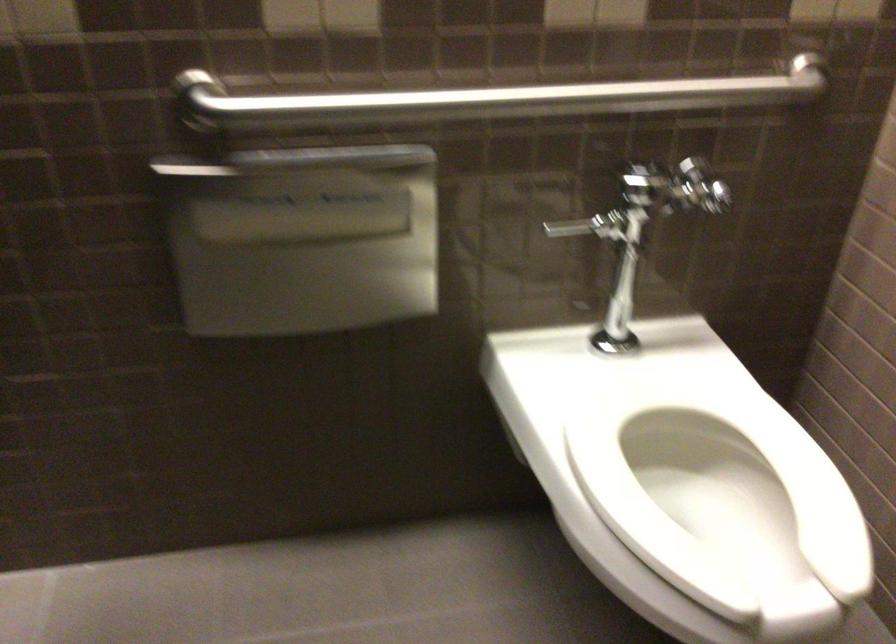
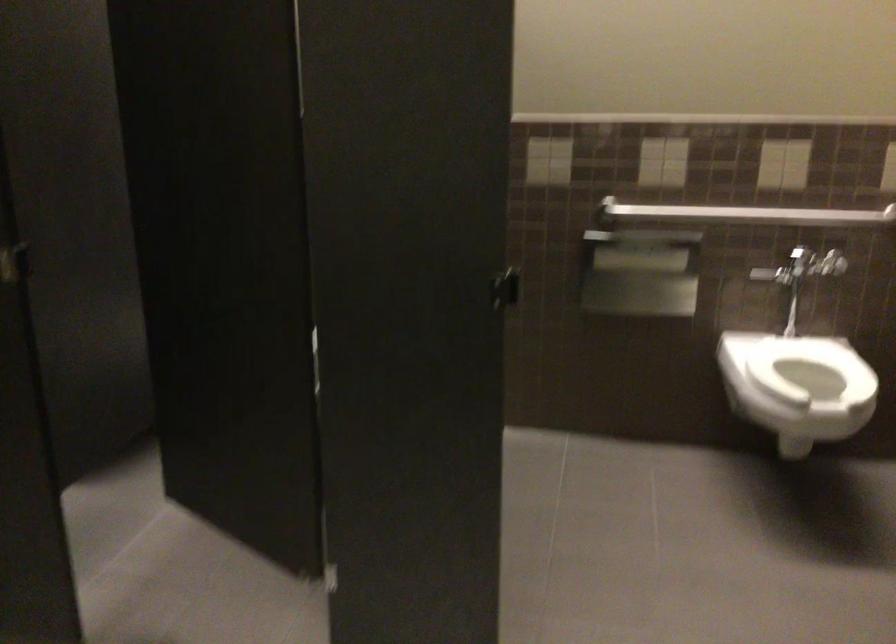
Locate, in the second image, the point that corresponds to pixel 657 442 in the first image.

(810, 368)